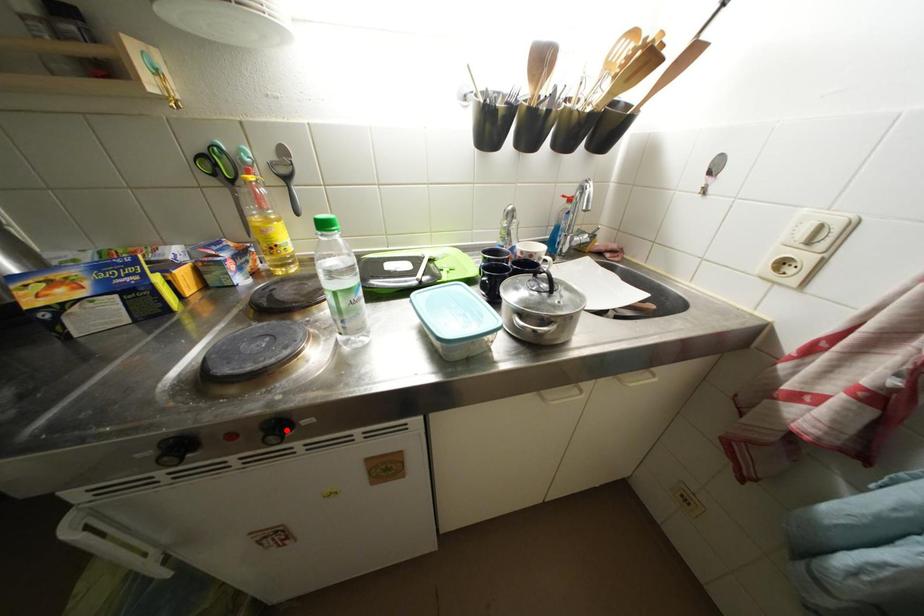
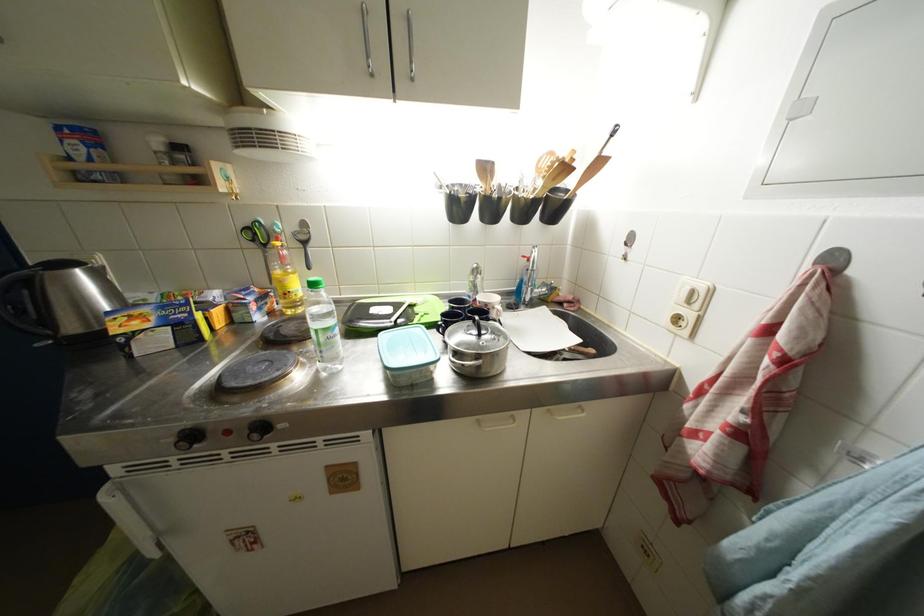
Question: I am providing you with two images of the same scene from different viewpoints. A red point is marked on the first image. At the location where the point appears in image 1, is it still visible in image 2?

Choices:
 (A) Yes
 (B) No

Answer: (A)